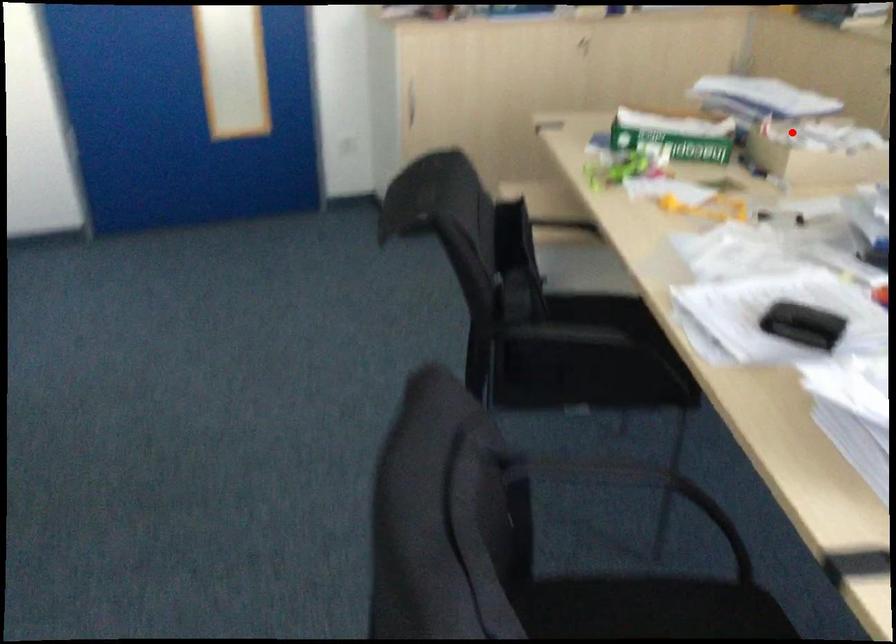
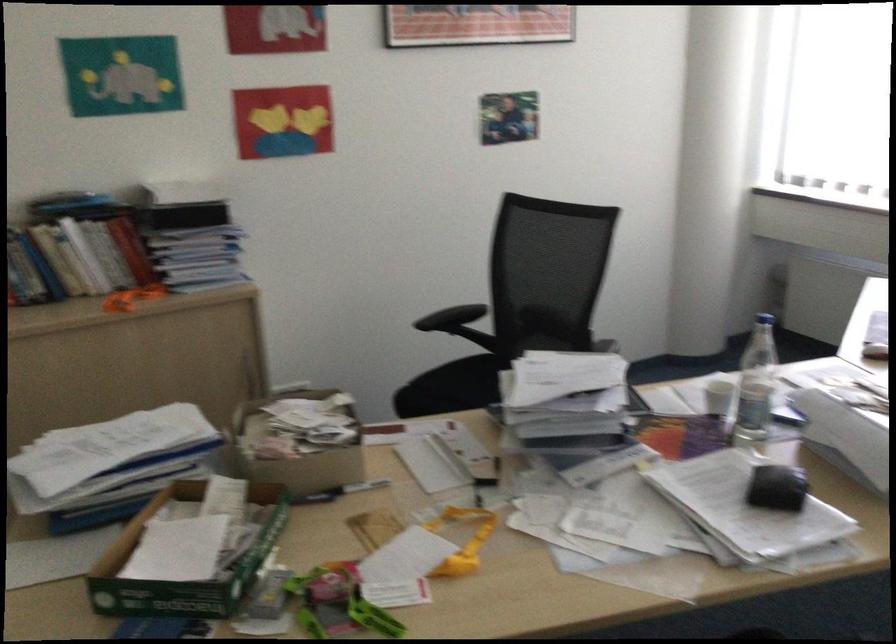
Question: I am providing you with two images of the same scene from different viewpoints. In image1, a red point is highlighted. Considering the same 3D point in image2, which of the following is correct?

Choices:
 (A) It is closer
 (B) It is farther

Answer: (A)